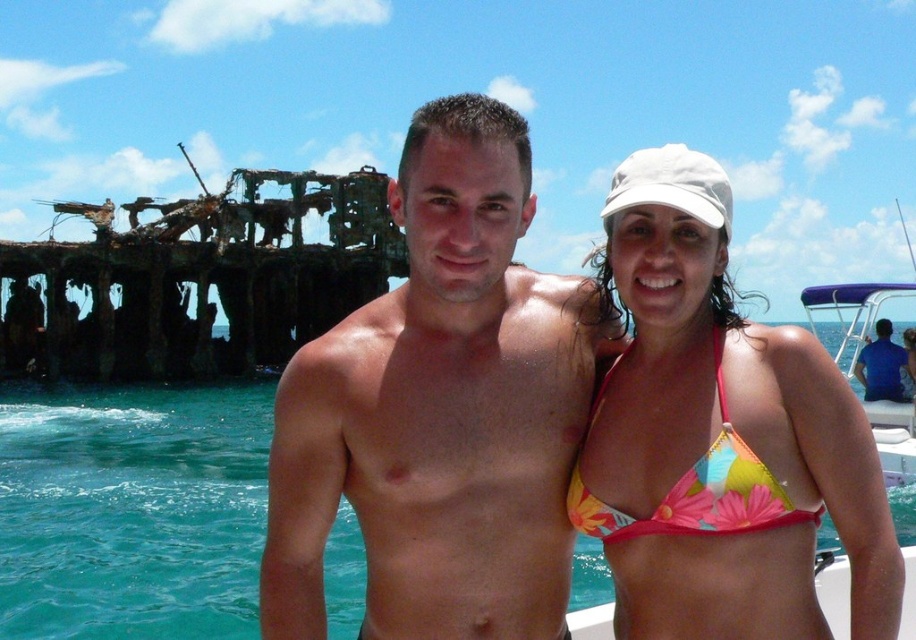
Question: Which of the following is the closest to the observer?

Choices:
 (A) (216, 486)
 (B) (598, 442)

Answer: (B)

Question: Among these objects, which one is farthest from the camera?

Choices:
 (A) floral print bikini top at upper right
 (B) floral bikini top at center
 (C) clear blue water at center

Answer: (C)

Question: Is floral bikini top at center in front of purple fabric boat at right?

Choices:
 (A) yes
 (B) no

Answer: (A)

Question: Is floral bikini top at center smaller than clear blue water at center?

Choices:
 (A) yes
 (B) no

Answer: (A)

Question: Based on their relative distances, which object is farther from the rusty metal shipwreck at left?

Choices:
 (A) floral bikini top at center
 (B) shiny skin torso at center
 (C) purple fabric boat at right
 (D) clear blue water at center

Answer: (A)

Question: Is floral bikini top at center behind purple fabric boat at right?

Choices:
 (A) no
 (B) yes

Answer: (A)